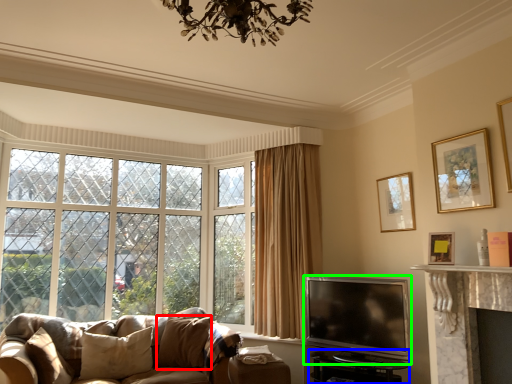
Question: Which object is positioned farthest from pillow (highlighted by a red box)? Select from table (highlighted by a blue box) and television (highlighted by a green box).

Choices:
 (A) table
 (B) television

Answer: (A)